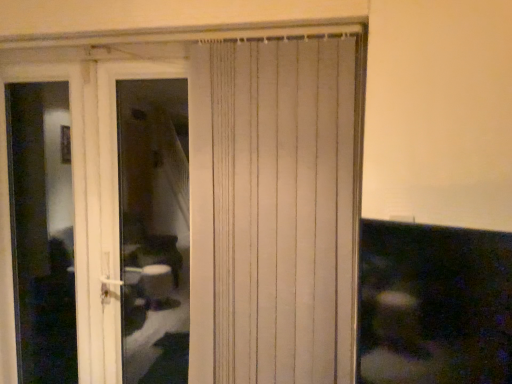
Question: Is point (106, 188) positioned closer to the camera than point (147, 162)?

Choices:
 (A) closer
 (B) farther

Answer: (A)

Question: Relative to white plastic door at left, is transparent glass screen door at left in front or behind?

Choices:
 (A) front
 (B) behind

Answer: (B)

Question: Which of these objects is positioned closest to the transparent glass screen door at left?

Choices:
 (A) white textured curtain at center
 (B) white plastic door at left

Answer: (A)

Question: Estimate the real-world distances between objects in this image. Which object is farther from the white plastic door at left?

Choices:
 (A) white textured curtain at center
 (B) transparent glass screen door at left

Answer: (A)